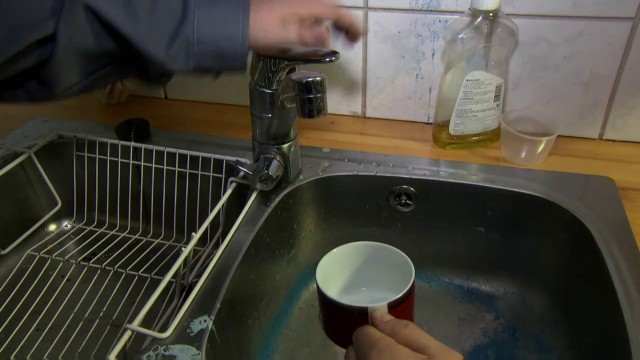
Locate an element on the screen. This screenshot has height=360, width=640. soap is located at coordinates (479, 97).